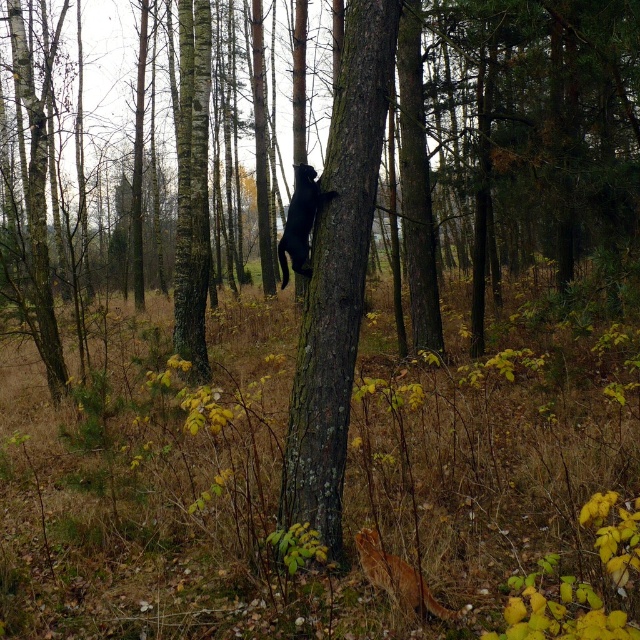
You are a hiker who wants to place a 20 inch long backpack between the smooth bark tree at center and the shiny black cat at center. Is there enough space?

The distance between the smooth bark tree at center and the shiny black cat at center is 23.48 inches, so yes, the backpack can fit as it is shorter than the available space.

You are a hiker who has spotted both the smooth bark tree at center and the shiny black cat at center in the forest. Which object is positioned lower in the scene?

The smooth bark tree at center is positioned lower than the shiny black cat at center.